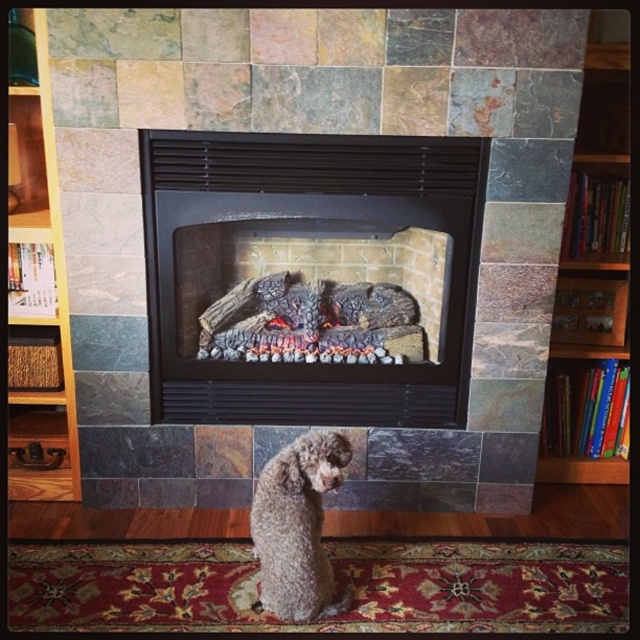
Question: From the image, what is the correct spatial relationship of wooden bookshelf at left in relation to brown wooden bookshelf at right?

Choices:
 (A) right
 (B) left

Answer: (B)

Question: Can you confirm if wooden bookshelf at left is positioned to the left of gray curly fur dog at center?

Choices:
 (A) no
 (B) yes

Answer: (B)

Question: Which is nearer to the brown wooden bookshelf at right?

Choices:
 (A) wooden bookshelf at left
 (B) black matte fireplace at center
 (C) gray curly fur dog at center

Answer: (B)

Question: Which object appears closest to the camera in this image?

Choices:
 (A) wooden bookshelf at left
 (B) black matte fireplace at center

Answer: (A)

Question: Which of the following is the closest to the observer?

Choices:
 (A) brown wooden bookshelf at right
 (B) wooden bookshelf at left

Answer: (B)

Question: Does black matte fireplace at center have a greater width compared to wooden bookshelf at left?

Choices:
 (A) no
 (B) yes

Answer: (B)